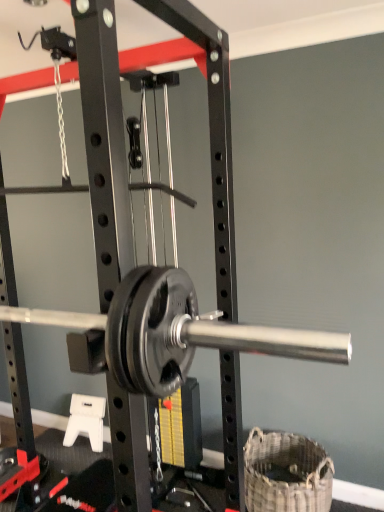
This screenshot has width=384, height=512. I want to click on woven brown basket at lower right, so click(x=288, y=471).

What do you see at coordinates (288, 471) in the screenshot? I see `woven brown basket at lower right` at bounding box center [288, 471].

Where is `woven brown basket at lower right`? The height and width of the screenshot is (512, 384). woven brown basket at lower right is located at coordinates (288, 471).